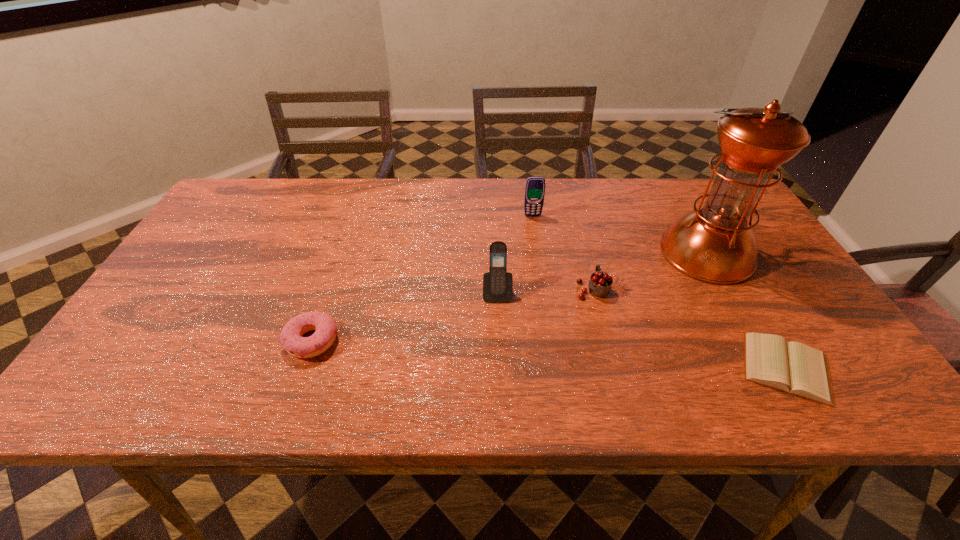
Locate an element on the screen. The width and height of the screenshot is (960, 540). free point that satisfies the following two spatial constraints: 1. on the front-facing side of the right cellular telephone; 2. on the left side of the tallest object is located at coordinates (538, 253).

Locate an element on the screen. The height and width of the screenshot is (540, 960). free space that satisfies the following two spatial constraints: 1. on the front-facing side of the tallest object; 2. on the right side of the right cellular telephone is located at coordinates (538, 253).